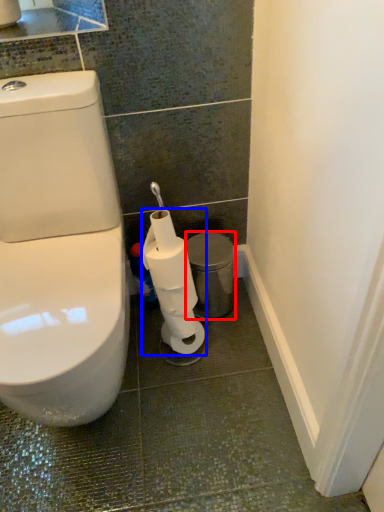
Question: Which object is closer to the camera taking this photo, porcelain (highlighted by a red box) or toilet paper (highlighted by a blue box)?

Choices:
 (A) porcelain
 (B) toilet paper

Answer: (B)